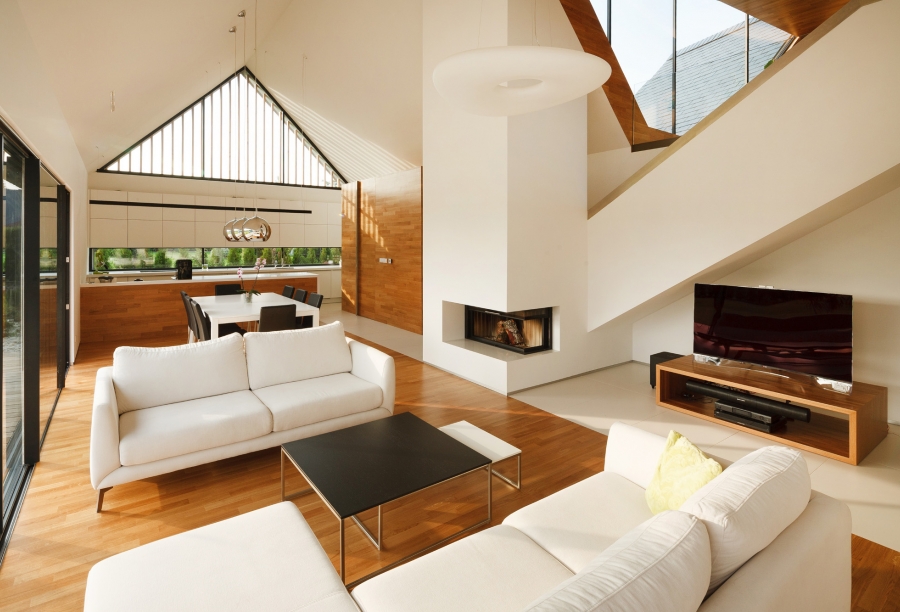
The width and height of the screenshot is (900, 612). I want to click on living room tables, so click(361, 491), click(502, 460).